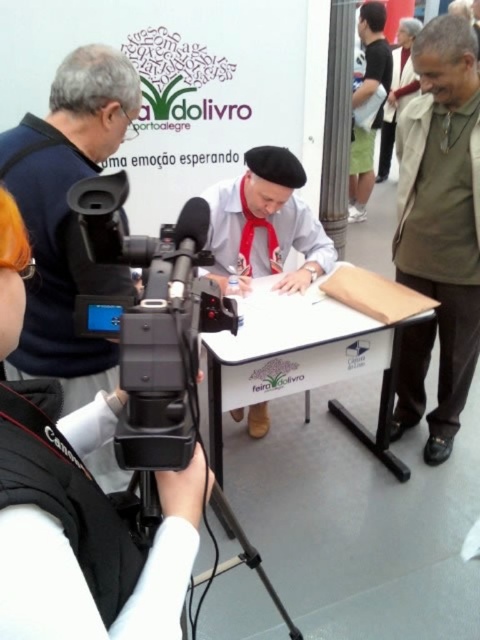
You are attending the book fair in Porto Alegre and notice two people dressed in khaki cotton jacket at right and white cotton shirt at center. Which one is positioned more to the east if the camera is facing north?

The khaki cotton jacket at right is positioned more to the east because it is to the right of the white cotton shirt at center, and since the camera is facing north, the right side of the camera corresponds to the east direction.

You are attending the Feira do Livro in Porto Alegre and notice a khaki cotton jacket at right. Where exactly is it located in the image?

The khaki cotton jacket at right is located at point (440, 228) in the image.

You are a photographer at the book fair in Porto Alegre. You need to adjust your camera so that the khaki cotton jacket at right is in focus while capturing the author signing books. Given the distance between the camera and the jacket, can you estimate if the current camera settings will allow both the author and the jacket to be in focus simultaneously?

The khaki cotton jacket at right and the camera are 5.93 feet apart. To determine if both the author and the jacket can be in focus, you need to consider the camera lens aperture. A smaller aperture like f16 would provide a deeper depth of field, likely keeping both the author and the jacket in focus. A wider aperture like f2.8 might result in the jacket being out of focus if it is significantly farther away. Adjust the aperture accordingly based on the distance between the author and the jacket.